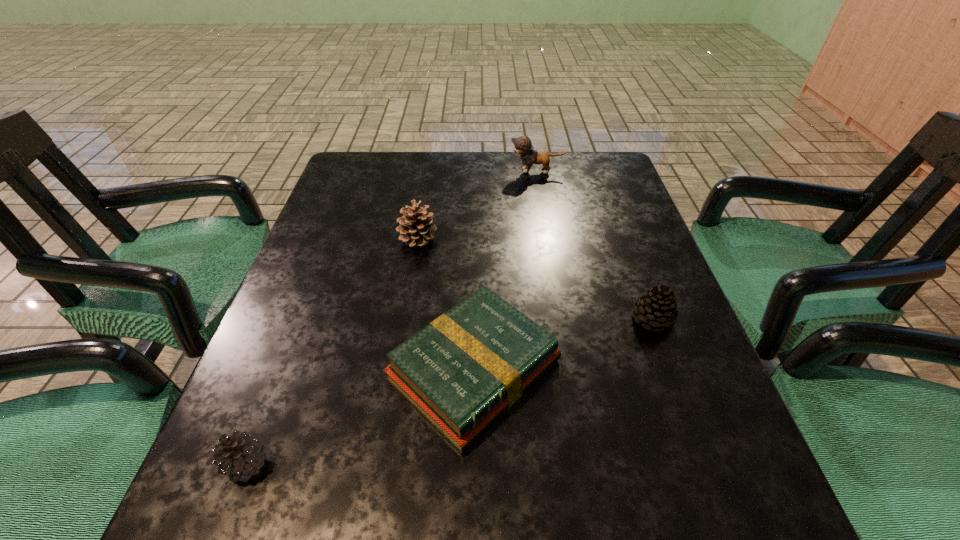
Image resolution: width=960 pixels, height=540 pixels. What are the coordinates of `object that is at the near left corner` in the screenshot? It's located at (242, 456).

Locate an element on the screen. object that is at the far right corner is located at coordinates (522, 145).

This screenshot has height=540, width=960. What are the coordinates of `vacant space at the far edge of the desktop` in the screenshot? It's located at (484, 194).

Locate an element on the screen. Image resolution: width=960 pixels, height=540 pixels. free space at the near edge is located at coordinates (384, 529).

The image size is (960, 540). Find the location of `free space at the left edge`. free space at the left edge is located at coordinates (300, 373).

The height and width of the screenshot is (540, 960). Find the location of `blank space at the right edge`. blank space at the right edge is located at coordinates (597, 212).

In the image, there is a desktop. At what (x,y) coordinates should I click in order to perform the action: click on vacant space at the far left corner. Please return your answer as a coordinate pair (x, y). Looking at the image, I should click on (368, 184).

The image size is (960, 540). Identify the location of vacant space that's between the second pinecone from left to right and the farthest object. (477, 205).

Where is `free space between the nearest pinecone and the farthest object`? free space between the nearest pinecone and the farthest object is located at coordinates (392, 318).

Where is `free space between the farthest object and the fourth nearest object`? free space between the farthest object and the fourth nearest object is located at coordinates (477, 205).